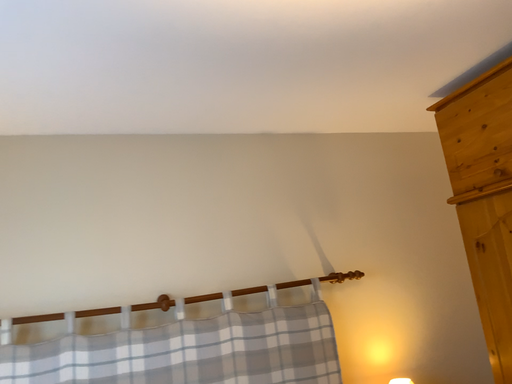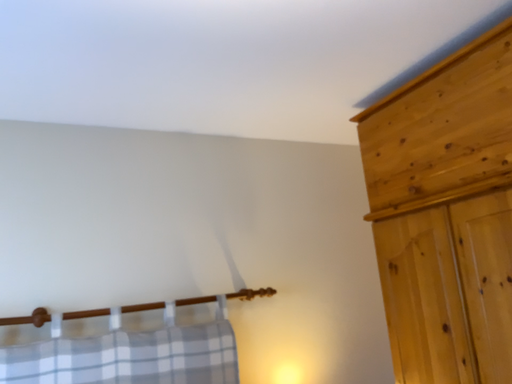
Question: How did the camera likely rotate when shooting the video?

Choices:
 (A) rotated right
 (B) rotated left

Answer: (A)